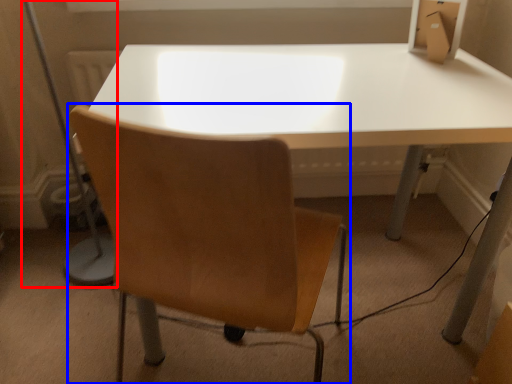
Question: Among these objects, which one is nearest to the camera, table lamp (highlighted by a red box) or chair (highlighted by a blue box)?

Choices:
 (A) table lamp
 (B) chair

Answer: (B)